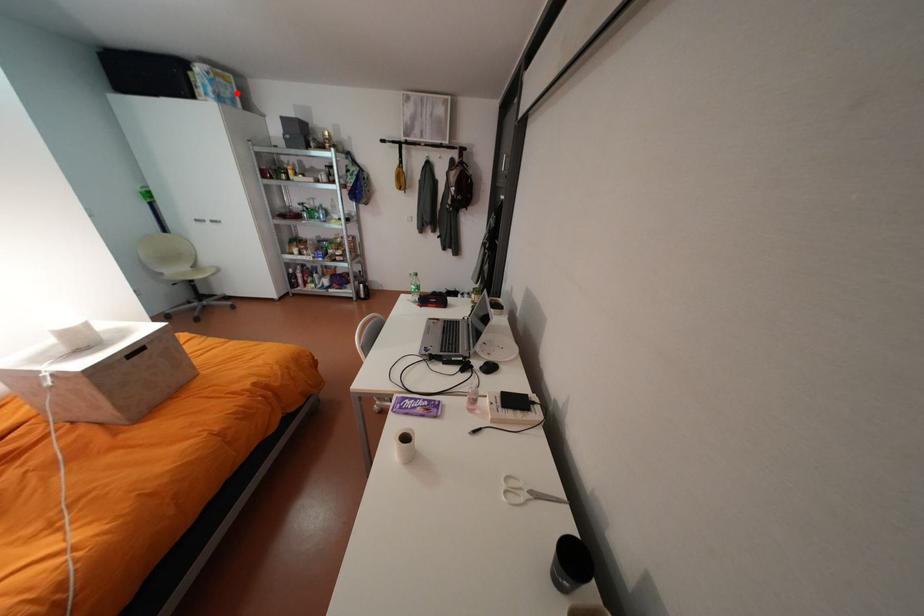
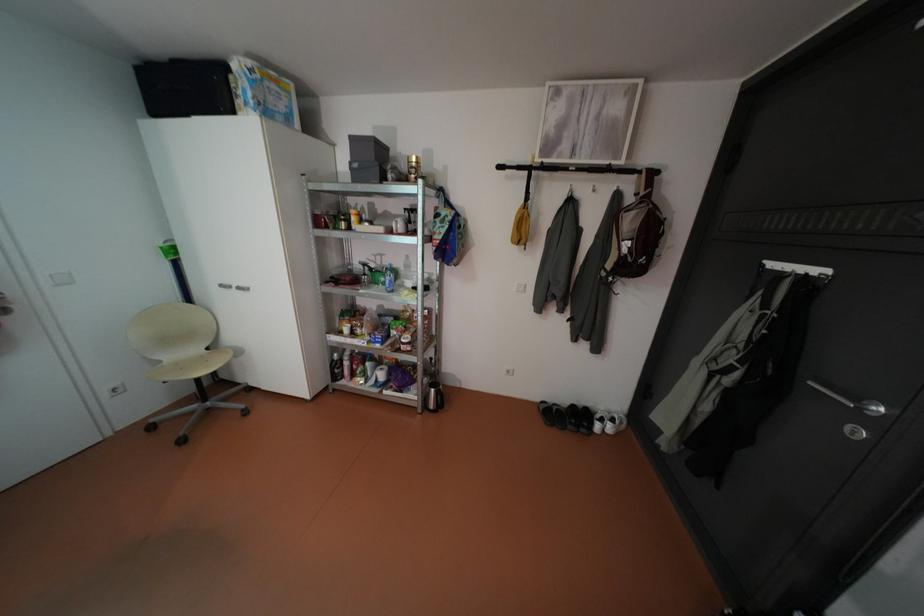
Find the pixel in the second image that matches the highlighted location in the first image.

(290, 107)